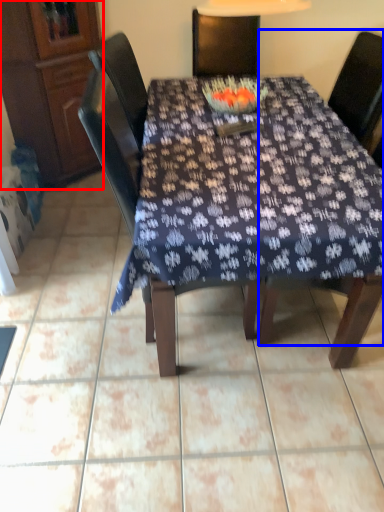
Question: Which object appears farthest to the camera in this image, cabinetry (highlighted by a red box) or chair (highlighted by a blue box)?

Choices:
 (A) cabinetry
 (B) chair

Answer: (A)